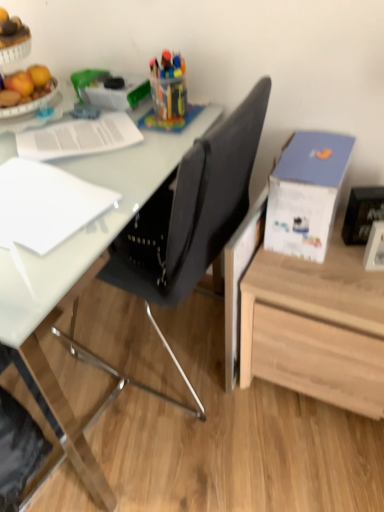
Question: Does white glossy picture frame at lower right, which is the 1th picture frame in bottom-to-top order, have a greater height compared to white paper at upper left, the first notebook when ordered from back to front?

Choices:
 (A) yes
 (B) no

Answer: (A)

Question: From a real-world perspective, is white glossy picture frame at lower right, which is the 1th picture frame in bottom-to-top order, located beneath white paper at upper left, acting as the 1th notebook starting from the top?

Choices:
 (A) no
 (B) yes

Answer: (B)

Question: From a real-world perspective, is white glossy picture frame at lower right, positioned as the 2th picture frame in top-to-bottom order, on top of white paper at upper left, the first notebook when ordered from back to front?

Choices:
 (A) no
 (B) yes

Answer: (A)

Question: Is white glossy picture frame at lower right, positioned as the 2th picture frame in top-to-bottom order, to the right of white paper at upper left, the second notebook positioned from the front, from the viewer's perspective?

Choices:
 (A) yes
 (B) no

Answer: (A)

Question: Is white glossy picture frame at lower right, positioned as the 2th picture frame in top-to-bottom order, oriented towards white paper at upper left, the second notebook positioned from the front?

Choices:
 (A) yes
 (B) no

Answer: (B)

Question: Relative to white paper at left, which is the first notebook in bottom-to-top order, is black glossy picture frame at upper right, the first picture frame viewed from the top, in front or behind?

Choices:
 (A) behind
 (B) front

Answer: (A)

Question: Based on their positions, is black glossy picture frame at upper right, which is the 2th picture frame in bottom-to-top order, located to the left or right of white paper at left, which is the first notebook in bottom-to-top order?

Choices:
 (A) left
 (B) right

Answer: (B)

Question: Is black glossy picture frame at upper right, which is the 2th picture frame in bottom-to-top order, spatially inside white paper at left, which is the first notebook in bottom-to-top order, or outside of it?

Choices:
 (A) outside
 (B) inside

Answer: (A)

Question: From the image's perspective, is black glossy picture frame at upper right, the first picture frame viewed from the top, positioned above or below white paper at left, acting as the second notebook starting from the top?

Choices:
 (A) below
 (B) above

Answer: (A)

Question: Is point (51, 208) closer or farther from the camera than point (120, 142)?

Choices:
 (A) closer
 (B) farther

Answer: (A)

Question: Relative to white paper at upper left, acting as the 1th notebook starting from the top, is white paper at left, which ranks as the second notebook in back-to-front order, in front or behind?

Choices:
 (A) behind
 (B) front

Answer: (B)

Question: Looking at their shapes, would you say white paper at left, which is the first notebook in bottom-to-top order, is wider or thinner than white paper at upper left, the second notebook positioned from the front?

Choices:
 (A) wide
 (B) thin

Answer: (B)

Question: From a real-world perspective, relative to white paper at upper left, the second notebook positioned from the front, is white paper at left, which ranks as the second notebook in back-to-front order, vertically above or below?

Choices:
 (A) above
 (B) below

Answer: (B)

Question: Do you think white paper at upper left, acting as the 1th notebook starting from the top, is within black fabric chair at center, or outside of it?

Choices:
 (A) outside
 (B) inside

Answer: (A)

Question: Is white paper at upper left, placed as the 2th notebook when sorted from bottom to top, wider or thinner than black fabric chair at center?

Choices:
 (A) thin
 (B) wide

Answer: (A)